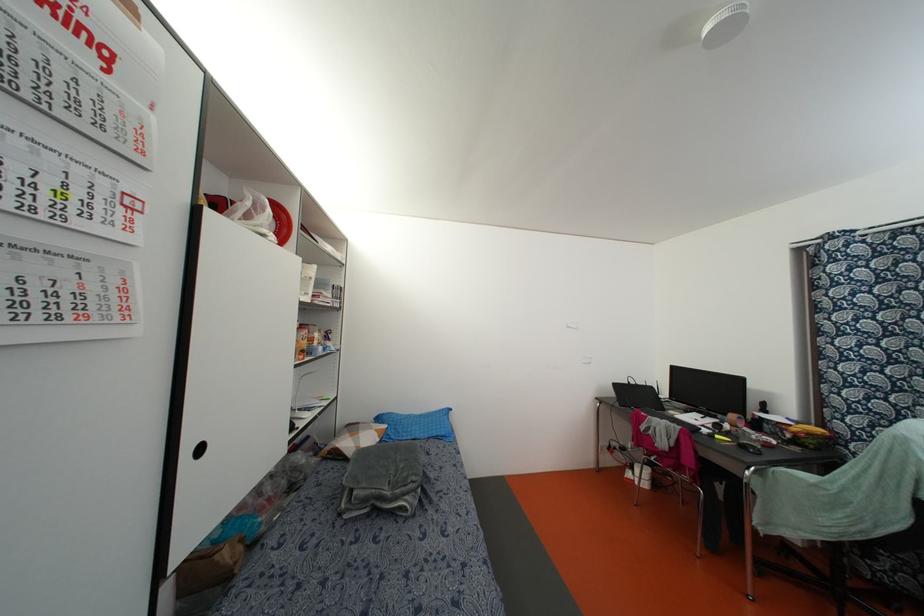
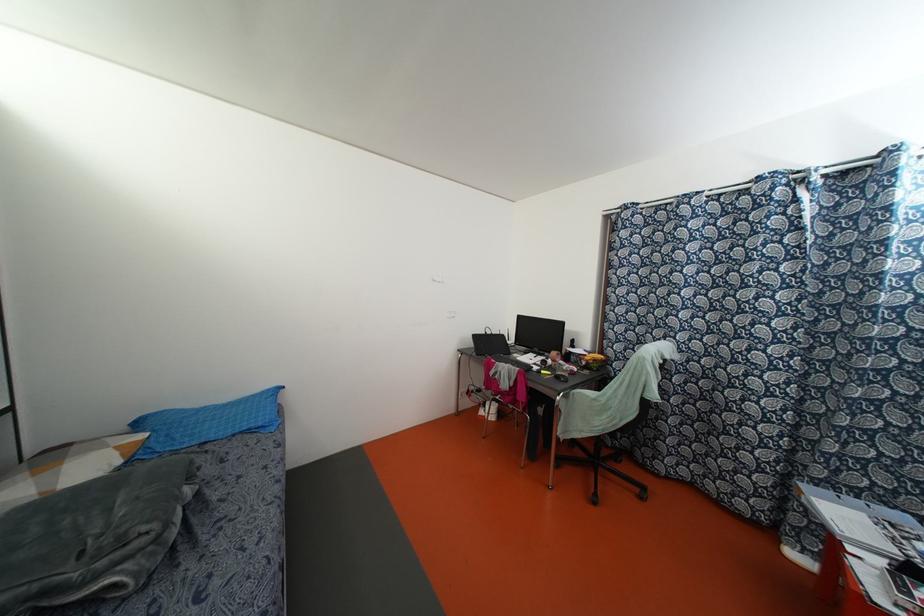
Find the pixel in the second image that matches point 442,434 in the first image.

(259, 424)